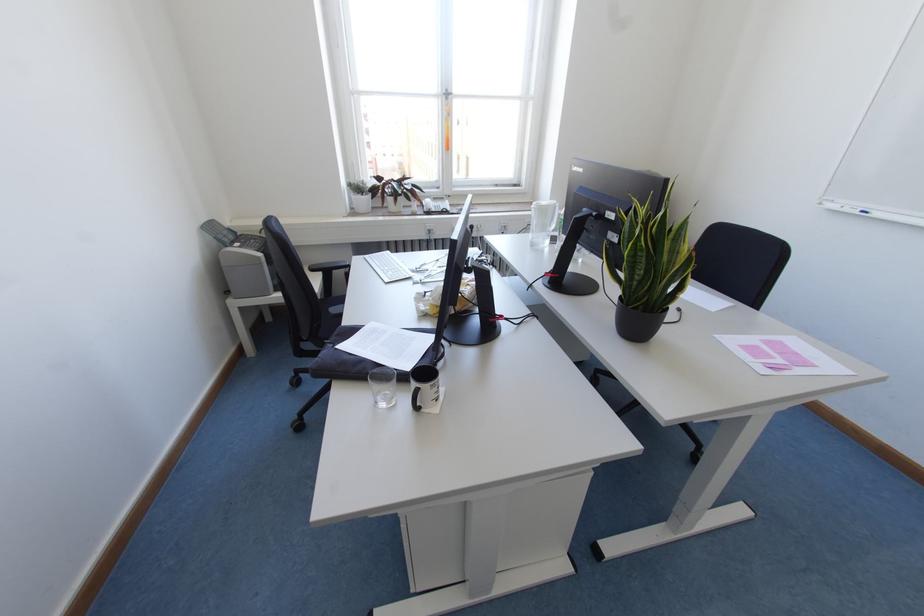
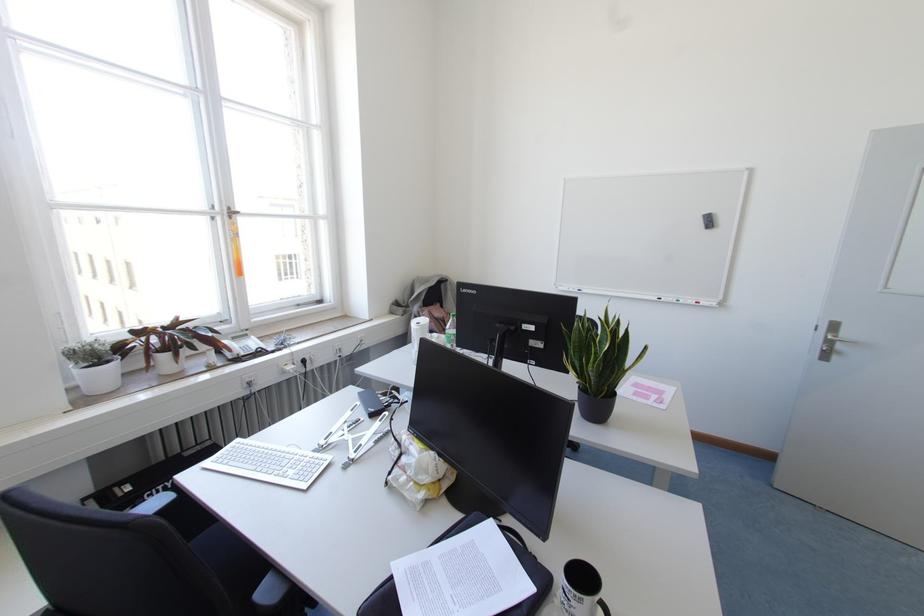
Question: I am providing you with two images of the same scene from different viewpoints. After the viewpoint changes to image2, which objects are now occluded?

Choices:
 (A) blue whiteboard marker
 (B) potted snake plant
 (C) grey whiteboard eraser
 (D) none of these

Answer: (D)